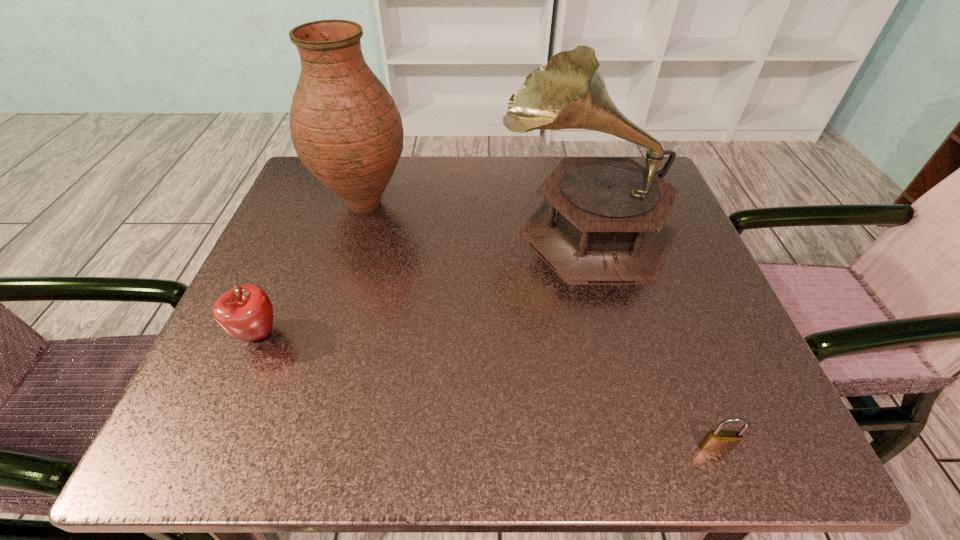
Identify the location of free region located 0.390m on the back of the third tallest object. (324, 182).

Image resolution: width=960 pixels, height=540 pixels. In order to click on vacant position located 0.260m on the back of the shortest object in this screenshot , I will do `click(658, 295)`.

This screenshot has height=540, width=960. In order to click on vase located in the far edge section of the desktop in this screenshot , I will do `click(345, 127)`.

This screenshot has height=540, width=960. Identify the location of phonograph record that is positioned at the far edge. (603, 219).

I want to click on object located in the near edge section of the desktop, so click(x=716, y=441).

Where is `vase that is at the left edge`? Image resolution: width=960 pixels, height=540 pixels. vase that is at the left edge is located at coordinates (345, 127).

The image size is (960, 540). Find the location of `apple at the left edge`. apple at the left edge is located at coordinates (245, 312).

You are a GUI agent. You are given a task and a screenshot of the screen. Output one action in this format:
    pyautogui.click(x=<x>, y=<y>)
    Task: Click on the phonograph record at the right edge
    This screenshot has width=960, height=540.
    Given the screenshot: What is the action you would take?
    pyautogui.click(x=603, y=219)

Where is `padlock at the right edge`? This screenshot has width=960, height=540. padlock at the right edge is located at coordinates (716, 441).

The height and width of the screenshot is (540, 960). Find the location of `object that is at the far left corner`. object that is at the far left corner is located at coordinates (345, 127).